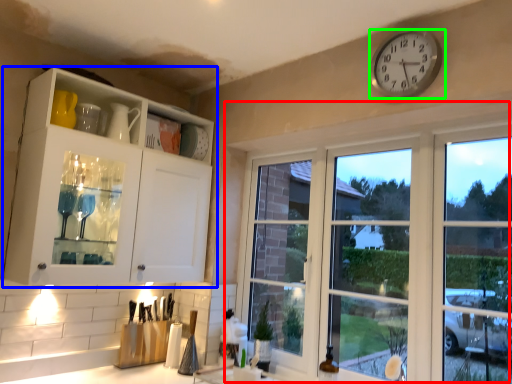
Question: Considering the real-world distances, which object is farthest from window (highlighted by a red box)? cabinetry (highlighted by a blue box) or wall clock (highlighted by a green box)?

Choices:
 (A) cabinetry
 (B) wall clock

Answer: (A)